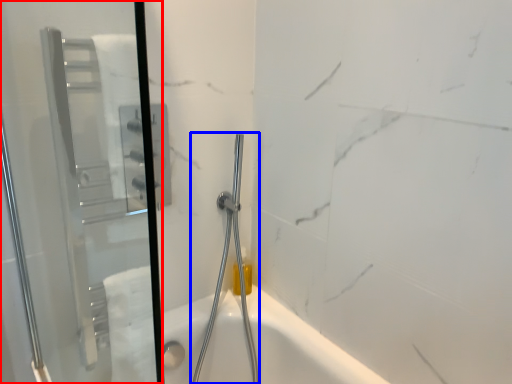
Question: Among these objects, which one is farthest to the camera, screen door (highlighted by a red box) or shower (highlighted by a blue box)?

Choices:
 (A) screen door
 (B) shower

Answer: (B)